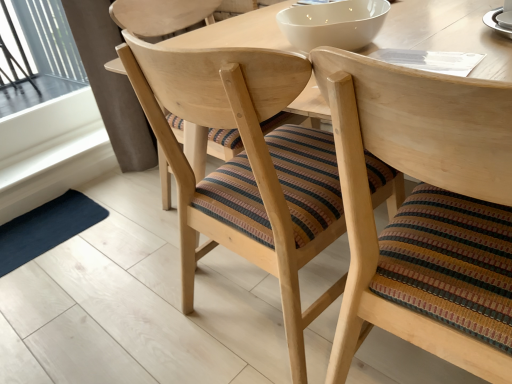
Question: From the image's perspective, is wooden chair with striped cushion at center, which is counted as the second chair, starting from the right, under white glossy bowl at upper center?

Choices:
 (A) yes
 (B) no

Answer: (A)

Question: Is the depth of wooden chair with striped cushion at center, which is counted as the second chair, starting from the right, less than that of white glossy bowl at upper center?

Choices:
 (A) yes
 (B) no

Answer: (A)

Question: Is wooden chair with striped cushion at center, which is counted as the second chair, starting from the right, facing towards white glossy bowl at upper center?

Choices:
 (A) yes
 (B) no

Answer: (A)

Question: From a real-world perspective, is wooden chair with striped cushion at center, arranged as the first chair when viewed from the left, below white glossy bowl at upper center?

Choices:
 (A) no
 (B) yes

Answer: (B)

Question: Can you confirm if wooden chair with striped cushion at center, which is counted as the second chair, starting from the right, is bigger than white glossy bowl at upper center?

Choices:
 (A) yes
 (B) no

Answer: (A)

Question: Which is correct: white glossy bowl at upper center is inside wooden chair with striped cushion at center, the first chair from the right, or outside of it?

Choices:
 (A) inside
 (B) outside

Answer: (B)

Question: In the image, is white glossy bowl at upper center positioned in front of or behind wooden chair with striped cushion at center, the second chair viewed from the left?

Choices:
 (A) front
 (B) behind

Answer: (B)

Question: Looking at their shapes, would you say white glossy bowl at upper center is wider or thinner than wooden chair with striped cushion at center, the second chair viewed from the left?

Choices:
 (A) thin
 (B) wide

Answer: (A)

Question: From the image's perspective, is white glossy bowl at upper center positioned above or below wooden chair with striped cushion at center, the second chair viewed from the left?

Choices:
 (A) below
 (B) above

Answer: (B)

Question: Is white glossy bowl at upper center spatially inside white glossy saucer at upper right, or outside of it?

Choices:
 (A) outside
 (B) inside

Answer: (A)

Question: From their relative heights in the image, would you say white glossy bowl at upper center is taller or shorter than white glossy saucer at upper right?

Choices:
 (A) short
 (B) tall

Answer: (B)

Question: Does point (355, 18) appear closer or farther from the camera than point (508, 36)?

Choices:
 (A) farther
 (B) closer

Answer: (A)

Question: Based on their sizes in the image, would you say white glossy bowl at upper center is bigger or smaller than white glossy saucer at upper right?

Choices:
 (A) small
 (B) big

Answer: (B)

Question: From the image's perspective, is white glossy saucer at upper right located above or below white glossy bowl at upper center?

Choices:
 (A) below
 (B) above

Answer: (A)

Question: Relative to white glossy bowl at upper center, is white glossy saucer at upper right in front or behind?

Choices:
 (A) front
 (B) behind

Answer: (A)